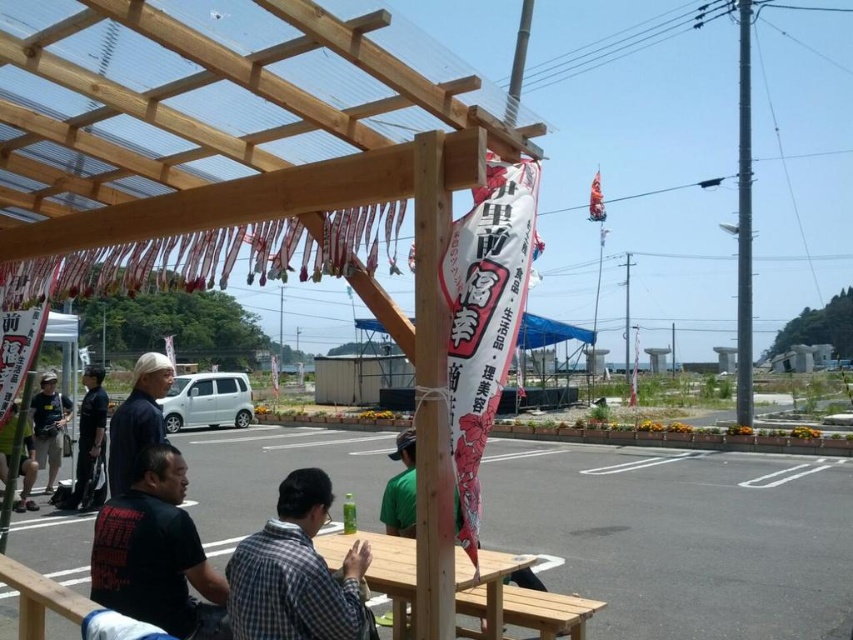
Question: Is dark blue uniform at left below green fabric shirt at center?

Choices:
 (A) no
 (B) yes

Answer: (B)

Question: Can you confirm if wooden picnic table at center is bigger than dark blue uniform at left?

Choices:
 (A) yes
 (B) no

Answer: (B)

Question: Considering the real-world distances, which object is farthest from the green fabric shirt at center?

Choices:
 (A) dark brown fabric cap at upper left
 (B) checkered shirt at center
 (C) wooden picnic table at center
 (D) black cotton shirt at lower left

Answer: (A)

Question: Which of these objects is positioned closest to the wooden picnic table at center?

Choices:
 (A) checkered shirt at center
 (B) black cotton shirt at lower left
 (C) dark blue uniform at left
 (D) green fabric shirt at center

Answer: (A)

Question: Can you confirm if dark blue uniform at left is positioned above green fabric shirt at center?

Choices:
 (A) no
 (B) yes

Answer: (A)

Question: Which object is farther from the camera taking this photo?

Choices:
 (A) dark brown fabric cap at upper left
 (B) black cotton shirt at lower left

Answer: (A)